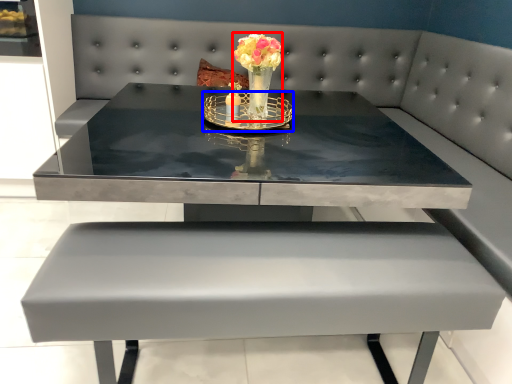
Question: Among these objects, which one is nearest to the camera, floral arrangement (highlighted by a red box) or candle holder (highlighted by a blue box)?

Choices:
 (A) floral arrangement
 (B) candle holder

Answer: (A)